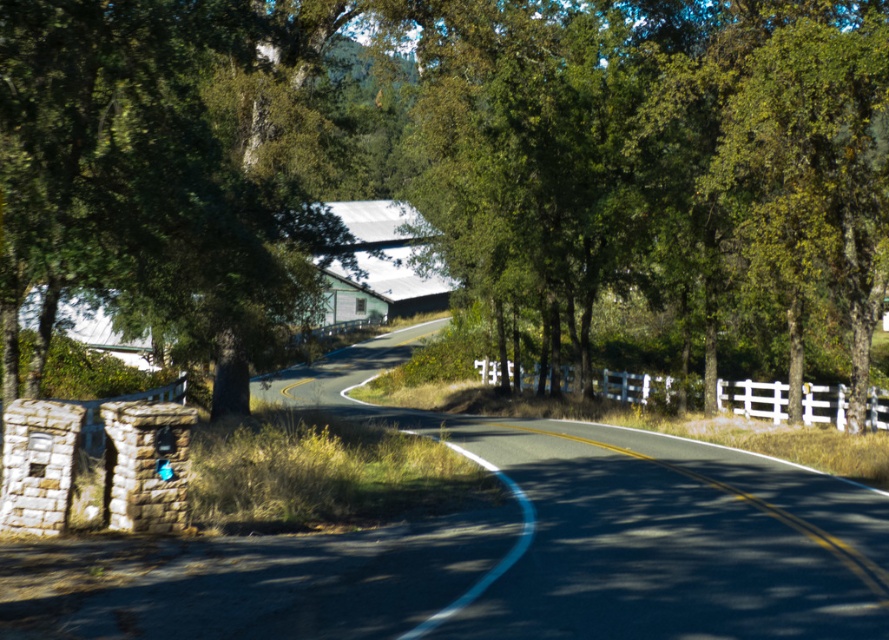
Question: Does green leafy tree at center have a smaller size compared to white wooden fence at center?

Choices:
 (A) no
 (B) yes

Answer: (A)

Question: Can you confirm if green leafy tree at center is positioned below white wooden fence at center?

Choices:
 (A) no
 (B) yes

Answer: (A)

Question: Which point is farther to the camera?

Choices:
 (A) green leafy tree at center
 (B) white wooden fence at center

Answer: (B)

Question: In this image, where is green leafy tree at center located relative to white wooden fence at center?

Choices:
 (A) below
 (B) above

Answer: (B)

Question: Which of the following is the farthest from the observer?

Choices:
 (A) green leafy tree at center
 (B) white wooden fence at center

Answer: (B)

Question: Which point is closer to the camera?

Choices:
 (A) (629, 138)
 (B) (751, 392)

Answer: (A)